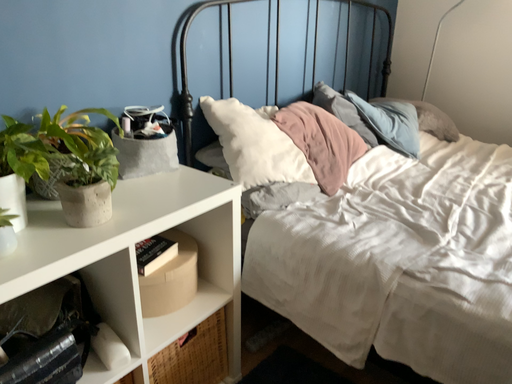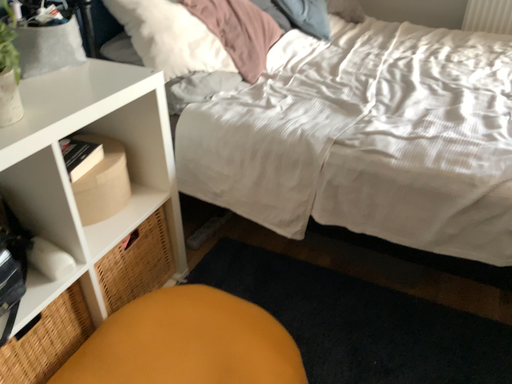
Question: How did the camera likely rotate when shooting the video?

Choices:
 (A) rotated right
 (B) rotated left

Answer: (A)